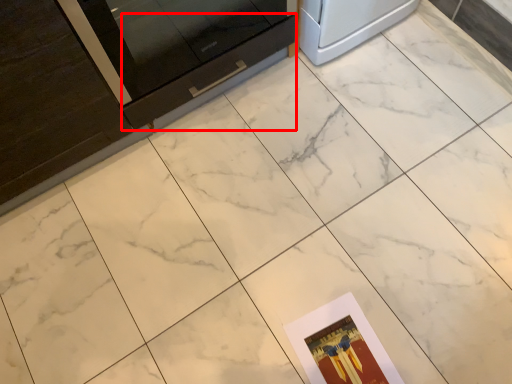
Question: In this image, where is drawer (annotated by the red box) located relative to postcard?

Choices:
 (A) right
 (B) left

Answer: (B)